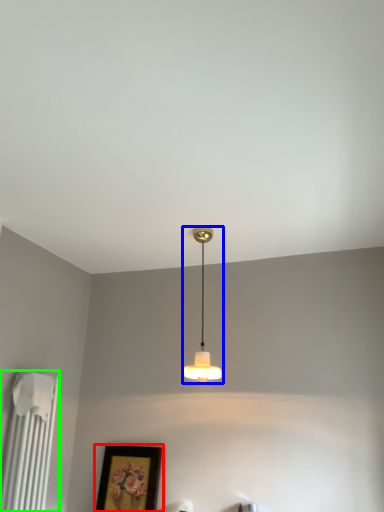
Question: Considering the real-world distances, which object is farthest from picture frame (highlighted by a red box)? lamp (highlighted by a blue box) or radiator (highlighted by a green box)?

Choices:
 (A) lamp
 (B) radiator

Answer: (A)